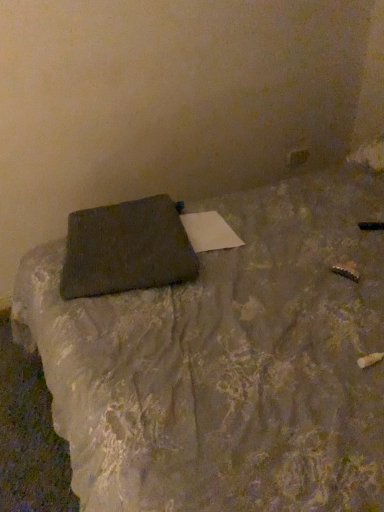
The image size is (384, 512). What do you see at coordinates (227, 362) in the screenshot?
I see `matte black folder at center` at bounding box center [227, 362].

At what (x,y) coordinates should I click in order to perform the action: click on matte black folder at center. Please return your answer as a coordinate pair (x, y). Image resolution: width=384 pixels, height=512 pixels. Looking at the image, I should click on (227, 362).

This screenshot has height=512, width=384. What do you see at coordinates (127, 248) in the screenshot?
I see `brown textured pillow at center` at bounding box center [127, 248].

Find the location of a particular element. brown textured pillow at center is located at coordinates (127, 248).

In order to face brown textured pillow at center, should I rotate leftwards or rightwards?

To align with it, rotate left about 9.069°.

This screenshot has width=384, height=512. In order to click on matte black folder at center in this screenshot , I will do `click(227, 362)`.

Is matte black folder at center to the right of brown textured pillow at center from the viewer's perspective?

Yes.

Relative to brown textured pillow at center, is matte black folder at center in front or behind?

Visually, matte black folder at center is located in front of brown textured pillow at center.

Is point (333, 456) closer to viewer compared to point (158, 240)?

Yes.

From the image's perspective, is matte black folder at center beneath brown textured pillow at center?

Yes.

In the scene shown: From a real-world perspective, which is physically below, matte black folder at center or brown textured pillow at center?

brown textured pillow at center.

Considering the sizes of objects matte black folder at center and brown textured pillow at center in the image provided, who is thinner, matte black folder at center or brown textured pillow at center?

brown textured pillow at center.

Does matte black folder at center have a greater height compared to brown textured pillow at center?

Yes, matte black folder at center is taller than brown textured pillow at center.

In the scene shown: Can you confirm if matte black folder at center is smaller than brown textured pillow at center?

No.

Is matte black folder at center spatially inside brown textured pillow at center, or outside of it?

matte black folder at center is not inside brown textured pillow at center, it's outside.

Are matte black folder at center and brown textured pillow at center located far from each other?

No, there isn't a large distance between matte black folder at center and brown textured pillow at center.

Is matte black folder at center oriented towards brown textured pillow at center?

Yes, matte black folder at center is oriented towards brown textured pillow at center.

This screenshot has height=512, width=384. In order to click on furniture lying in front of the brown textured pillow at center in this screenshot , I will do `click(227, 362)`.

Is brown textured pillow at center at the right side of matte black folder at center?

In fact, brown textured pillow at center is to the left of matte black folder at center.

Is brown textured pillow at center positioned behind matte black folder at center?

Yes, brown textured pillow at center is behind matte black folder at center.

Looking at this image, which is nearer, (168, 213) or (329, 271)?

The point (329, 271) is in front.

From the image's perspective, between brown textured pillow at center and matte black folder at center, who is located below?

matte black folder at center is shown below in the image.

From a real-world perspective, relative to matte black folder at center, is brown textured pillow at center vertically above or below?

From a real-world perspective, brown textured pillow at center is physically below matte black folder at center.

Does brown textured pillow at center have a greater width compared to matte black folder at center?

No, brown textured pillow at center is not wider than matte black folder at center.

Can you confirm if brown textured pillow at center is shorter than matte black folder at center?

Yes.

Between brown textured pillow at center and matte black folder at center, which one has smaller size?

brown textured pillow at center is smaller.

Would you say brown textured pillow at center is outside matte black folder at center?

No, brown textured pillow at center is inside matte black folder at center's boundary.

Is brown textured pillow at center beside matte black folder at center?

No, brown textured pillow at center is not beside matte black folder at center.

Could you tell me if brown textured pillow at center is turned towards matte black folder at center?

Yes.

What's the angular difference between brown textured pillow at center and matte black folder at center's facing directions?

The angle between the facing direction of brown textured pillow at center and the facing direction of matte black folder at center is 17.1 degrees.

This screenshot has width=384, height=512. Find the location of `furniture below the brown textured pillow at center (from the image's perspective)`. furniture below the brown textured pillow at center (from the image's perspective) is located at coordinates (227, 362).

At what (x,y) coordinates should I click in order to perform the action: click on pillow behind the matte black folder at center. Please return your answer as a coordinate pair (x, y). Looking at the image, I should click on (127, 248).

Locate an element on the screen. furniture below the brown textured pillow at center (from the image's perspective) is located at coordinates (227, 362).